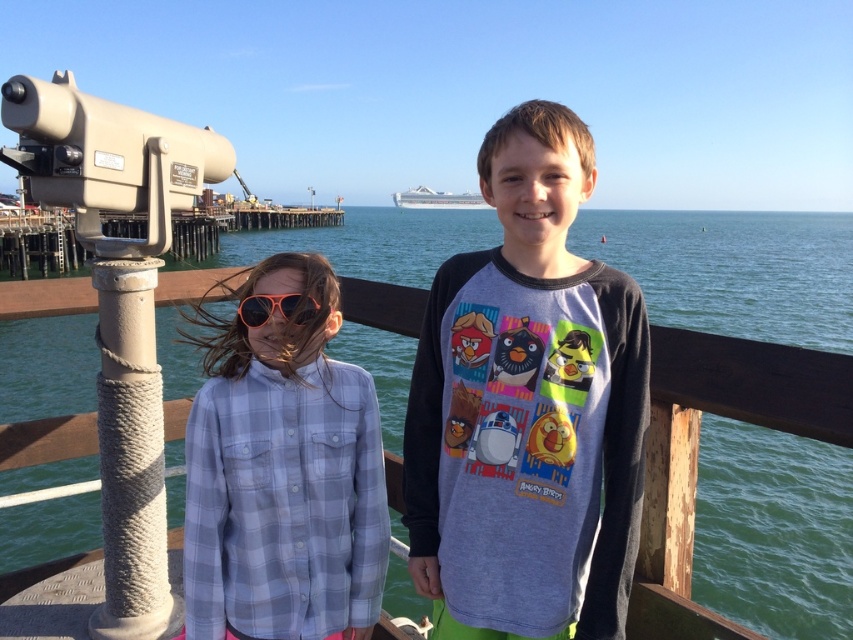
Question: Does plaid flannel shirt at center have a smaller size compared to beige rope-wrapped telescope at left?

Choices:
 (A) no
 (B) yes

Answer: (B)

Question: Among these points, which one is nearest to the camera?

Choices:
 (A) (164, 234)
 (B) (247, 308)

Answer: (B)

Question: Does beige rope-wrapped telescope at left have a greater width compared to orange reflective sunglasses at center?

Choices:
 (A) yes
 (B) no

Answer: (A)

Question: Which object is farther from the camera taking this photo?

Choices:
 (A) gray cotton shirt at center
 (B) green water at lower center

Answer: (B)

Question: Which point is farther from the camera taking this photo?

Choices:
 (A) (195, 577)
 (B) (267, 301)
 (C) (602, 262)
 (D) (109, 586)

Answer: (D)

Question: Can you confirm if green water at lower center is thinner than orange reflective sunglasses at center?

Choices:
 (A) yes
 (B) no

Answer: (B)